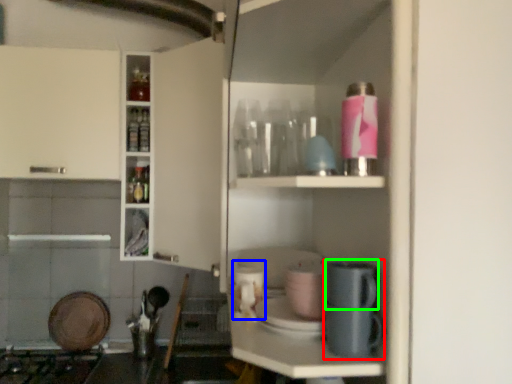
Question: Based on their relative distances, which object is nearer to coffee machine (highlighted by a red box)? Choose from appliance (highlighted by a blue box) and appliance (highlighted by a green box).

Choices:
 (A) appliance
 (B) appliance

Answer: (B)